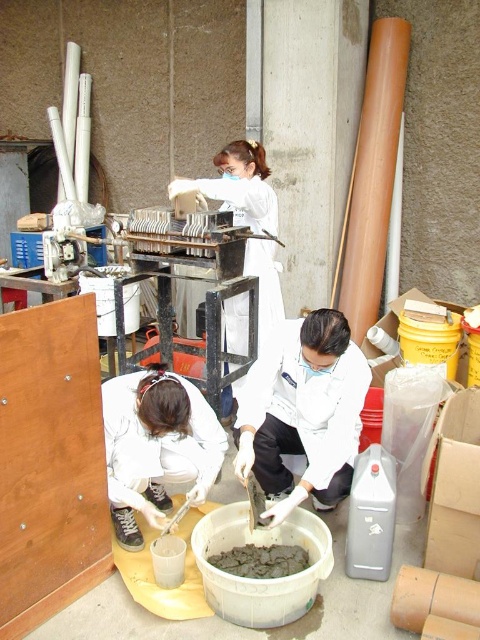
Based on the scene described, can you determine the spatial relationship between the white matte lab coat at lower left and the gray matte concrete at center?

The white matte lab coat at lower left is above the gray matte concrete at center.